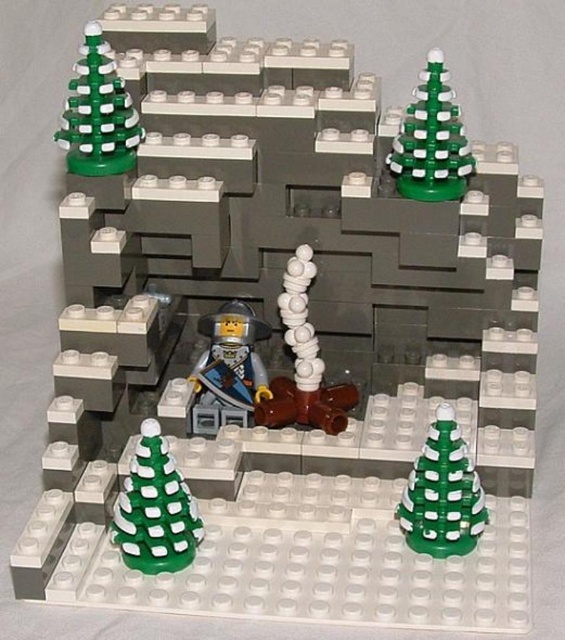
Is green matte christmas tree at upper left shorter than green matte christmas tree at upper right?

No, green matte christmas tree at upper left is not shorter than green matte christmas tree at upper right.

Which of these two, green matte christmas tree at upper left or green matte christmas tree at upper right, stands shorter?

Standing shorter between the two is green matte christmas tree at upper right.

The width and height of the screenshot is (565, 640). Describe the element at coordinates (97, 113) in the screenshot. I see `green matte christmas tree at upper left` at that location.

Where is `green matte christmas tree at upper left`? The image size is (565, 640). green matte christmas tree at upper left is located at coordinates tap(97, 113).

Is point (72, 163) in front of point (302, 310)?

Yes, point (72, 163) is closer to viewer.

Who is shorter, green matte christmas tree at upper left or white matte pipe at center?

Standing shorter between the two is green matte christmas tree at upper left.

Between point (93, 36) and point (310, 406), which one is positioned in front?

Point (93, 36) is more forward.

Image resolution: width=565 pixels, height=640 pixels. I want to click on green matte christmas tree at upper left, so tap(97, 113).

Who is taller, green matte christmas tree at lower right or green matte christmas tree at upper right?

With more height is green matte christmas tree at upper right.

Does green matte christmas tree at lower right have a lesser height compared to green matte christmas tree at upper right?

Yes, green matte christmas tree at lower right is shorter than green matte christmas tree at upper right.

Locate an element on the screen. This screenshot has height=640, width=565. green matte christmas tree at lower right is located at coordinates (442, 493).